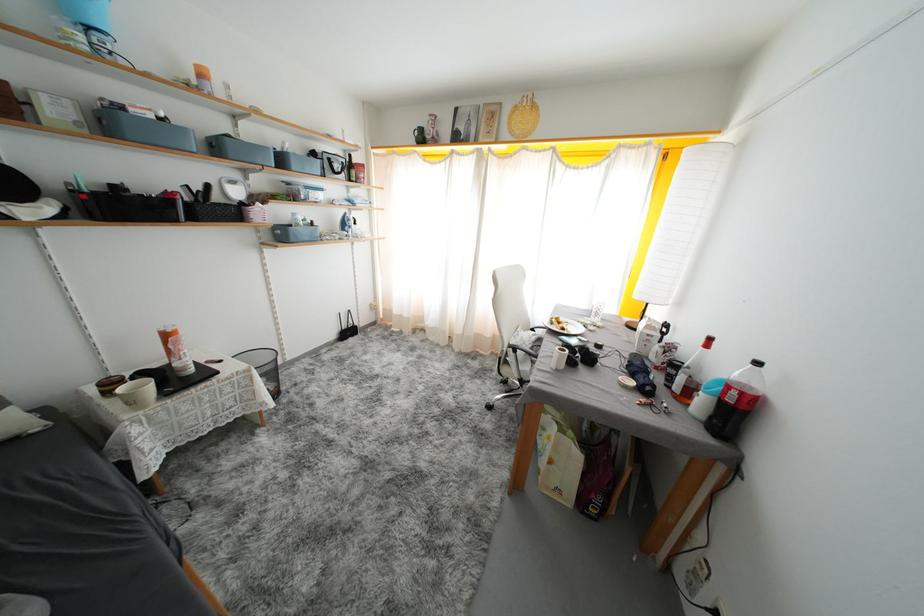
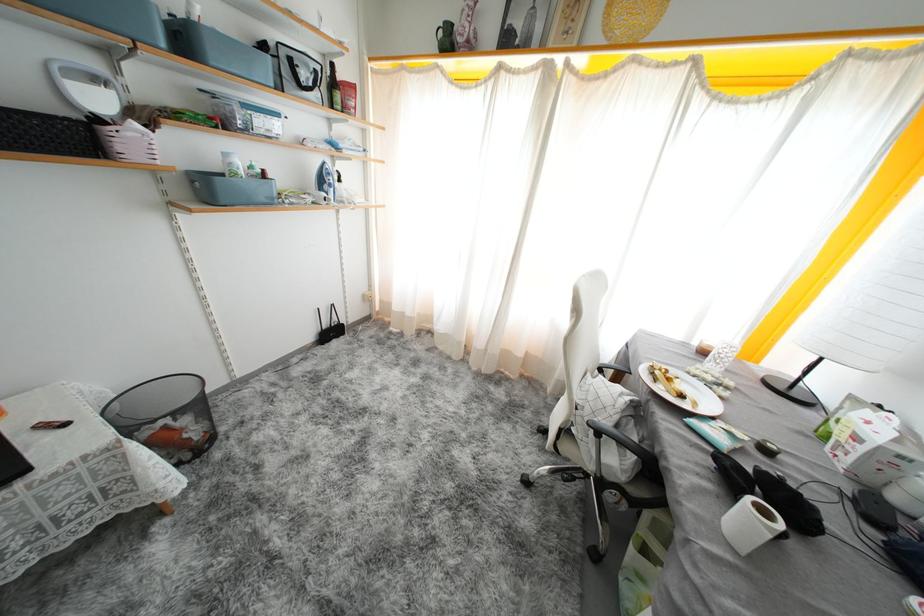
Question: Based on the continuous images, in which direction is the camera rotating? Reply with the corresponding letter.

Choices:
 (A) Left
 (B) Right
 (C) Up
 (D) Down

Answer: (D)